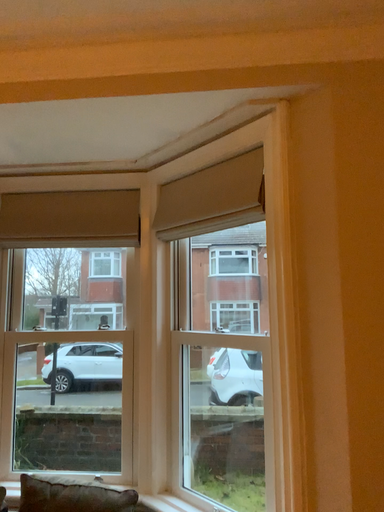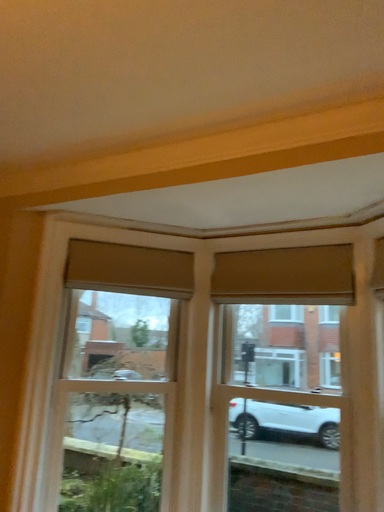
Question: Which way did the camera rotate in the video?

Choices:
 (A) rotated left
 (B) rotated right

Answer: (A)